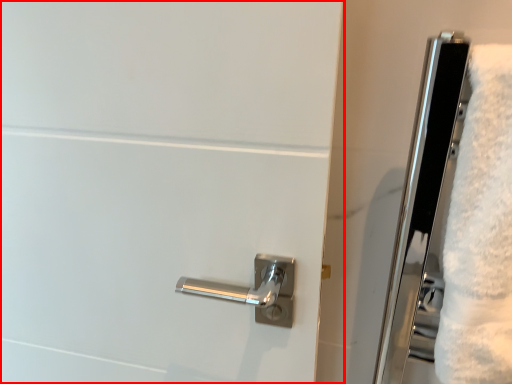
Question: Where is door (annotated by the red box) located in relation to bath towel in the image?

Choices:
 (A) left
 (B) right

Answer: (A)